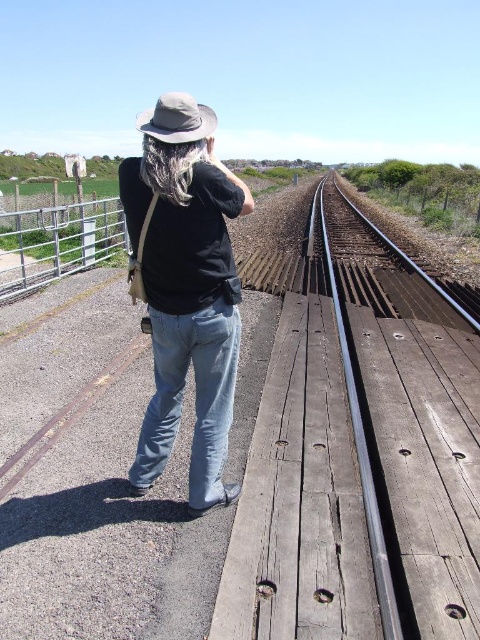
Does smooth metal train track at center appear under metallic gate at left?

Yes, smooth metal train track at center is below metallic gate at left.

Measure the distance between point (x=356, y=272) and camera.

Point (x=356, y=272) and camera are 10.82 meters apart from each other.

This screenshot has height=640, width=480. What do you see at coordinates (358, 449) in the screenshot? I see `smooth metal train track at center` at bounding box center [358, 449].

At what (x,y) coordinates should I click in order to perform the action: click on smooth metal train track at center. Please return your answer as a coordinate pair (x, y). The image size is (480, 640). Looking at the image, I should click on (358, 449).

Is black cotton shirt at center further to the viewer compared to khaki fabric cowboy hat at upper center?

No, it is in front of khaki fabric cowboy hat at upper center.

Between black cotton shirt at center and khaki fabric cowboy hat at upper center, which one has less height?

Standing shorter between the two is khaki fabric cowboy hat at upper center.

Does point (176, 396) come closer to viewer compared to point (193, 138)?

That is False.

Identify the location of black cotton shirt at center. The height and width of the screenshot is (640, 480). (187, 289).

Is black cotton shirt at center thinner than metallic gate at left?

Correct, black cotton shirt at center's width is less than metallic gate at left's.

Describe the element at coordinates (187, 289) in the screenshot. I see `black cotton shirt at center` at that location.

Locate an element on the screen. black cotton shirt at center is located at coordinates (187, 289).

Locate an element on the screen. Image resolution: width=480 pixels, height=640 pixels. black cotton shirt at center is located at coordinates (187, 289).